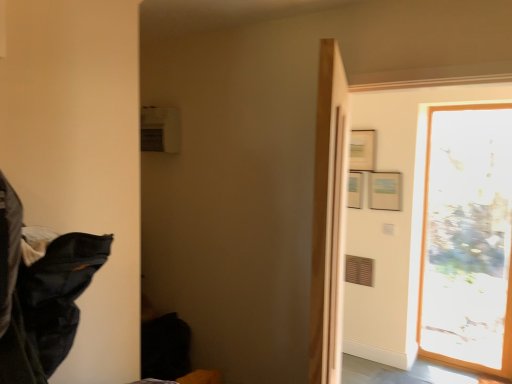
Question: From a real-world perspective, relative to transparent glass door at right, is black fabric at left vertically above or below?

Choices:
 (A) above
 (B) below

Answer: (A)

Question: Is black fabric at left taller or shorter than transparent glass door at right?

Choices:
 (A) short
 (B) tall

Answer: (A)

Question: Choose the correct answer: Is black fabric at left inside transparent glass door at right or outside it?

Choices:
 (A) inside
 (B) outside

Answer: (B)

Question: Choose the correct answer: Is transparent glass door at right inside black fabric at left or outside it?

Choices:
 (A) outside
 (B) inside

Answer: (A)

Question: Is transparent glass door at right wider or thinner than black fabric at left?

Choices:
 (A) wide
 (B) thin

Answer: (B)

Question: Considering the positions of point (456, 359) and point (4, 306), is point (456, 359) closer or farther from the camera than point (4, 306)?

Choices:
 (A) closer
 (B) farther

Answer: (B)

Question: From the image's perspective, is transparent glass door at right located above or below black fabric at left?

Choices:
 (A) below
 (B) above

Answer: (A)